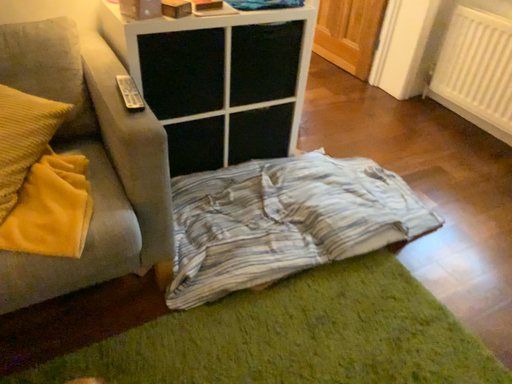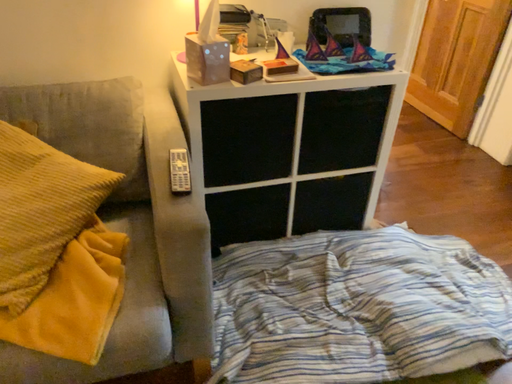
Question: Which way did the camera rotate in the video?

Choices:
 (A) rotated left
 (B) rotated right

Answer: (A)